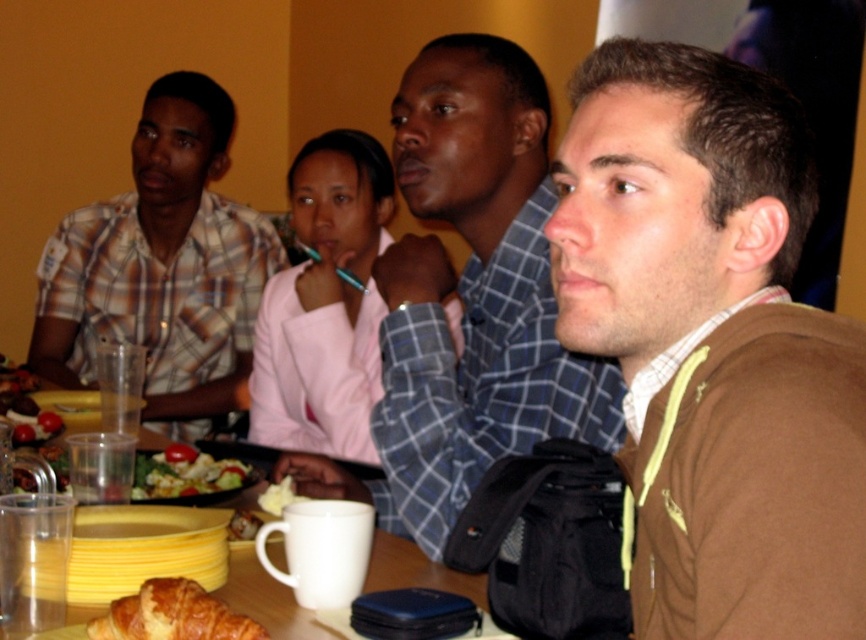
You are standing at the entrance of the room and want to greet the person wearing the matte blue shirt at center. Which direction should you walk to reach them?

Since the matte blue shirt at center is located at coordinates point (469, 298), you should walk towards the center of the room to reach them.

You are planning to place a small decorative item on the table where the matte blue shirt at center and the yellow creamy butter at center are located. Considering their sizes, which object would be a better reference for ensuring the item fits appropriately?

The matte blue shirt at center has a larger size compared to the yellow creamy butter at center, so using the matte blue shirt at center as a reference would ensure the decorative item fits appropriately.

You are a waiter in a restaurant and need to deliver a drink to the table shown in the image. The drink must be placed on the table such that it doesn not interfere with the golden brown flaky croissant at lower left. Where should you place the drink?

The golden brown flaky croissant at lower left is located at point (172, 614), so you should place the drink away from that coordinate to avoid interference.